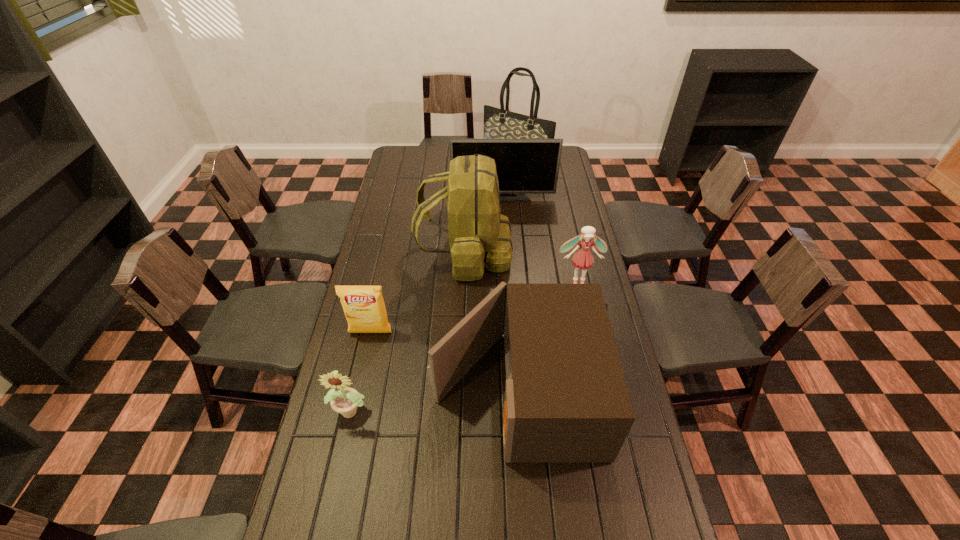
You are a GUI agent. You are given a task and a screenshot of the screen. Output one action in this format:
    pyautogui.click(x=<x>, y=<y>)
    Task: Click on the vacant space situated 0.130m on the front-facing side of the doll
    This screenshot has width=960, height=540.
    Given the screenshot: What is the action you would take?
    pyautogui.click(x=586, y=318)

This screenshot has height=540, width=960. I want to click on blank space located 0.170m with the door open on the front of the microwave oven, so click(x=376, y=390).

Image resolution: width=960 pixels, height=540 pixels. In order to click on free space located 0.230m with the door open on the front of the microwave oven in this screenshot , I will do `click(356, 390)`.

This screenshot has width=960, height=540. Find the location of `vacant point located with the door open on the front of the microwave oven`. vacant point located with the door open on the front of the microwave oven is located at coordinates (356, 390).

This screenshot has width=960, height=540. What are the coordinates of `vacant space located on the front of the crisp (potato chip) with the logo` in the screenshot? It's located at (345, 450).

This screenshot has width=960, height=540. What are the coordinates of `vacant region located on the front-facing side of the sunflower` in the screenshot? It's located at (333, 497).

I want to click on object at the far edge, so click(498, 123).

Identify the location of crisp (potato chip) located at the left edge. (364, 308).

This screenshot has width=960, height=540. In order to click on sunflower at the left edge in this screenshot , I will do `click(345, 401)`.

At what (x,y) coordinates should I click in order to perform the action: click on tote bag that is at the right edge. Please return your answer as a coordinate pair (x, y). This screenshot has width=960, height=540. Looking at the image, I should click on (498, 123).